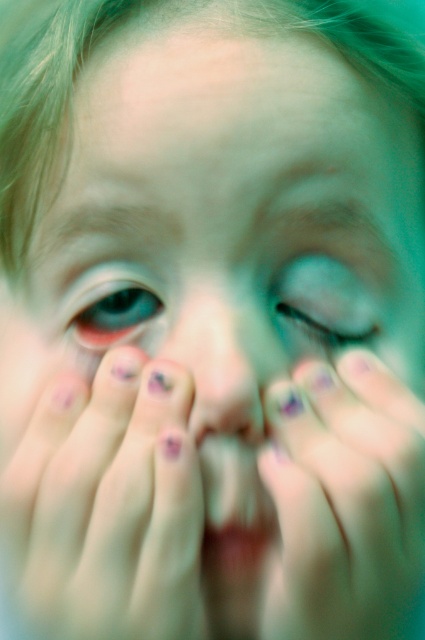
Question: Which of these objects is positioned closest to the purple painted nails at center?

Choices:
 (A) translucent blue eye at center
 (B) smooth pink lips at center

Answer: (B)

Question: Is matte purple nail polish at center to the left of smooth pink lips at center from the viewer's perspective?

Choices:
 (A) no
 (B) yes

Answer: (B)

Question: In this image, where is blue glossy eye at center located relative to smooth pink lips at center?

Choices:
 (A) above
 (B) below

Answer: (A)

Question: Considering the real-world distances, which object is closest to the blue glossy eye at center?

Choices:
 (A) matte purple nail polish at center
 (B) pink matte/natural nose at center

Answer: (B)

Question: Can you confirm if purple painted nails at center is positioned below translucent blue eye at center?

Choices:
 (A) no
 (B) yes

Answer: (B)

Question: Which of the following is the closest to the observer?

Choices:
 (A) matte purple nail polish at center
 (B) pink matte/natural nose at center
 (C) smooth pink lips at center

Answer: (A)